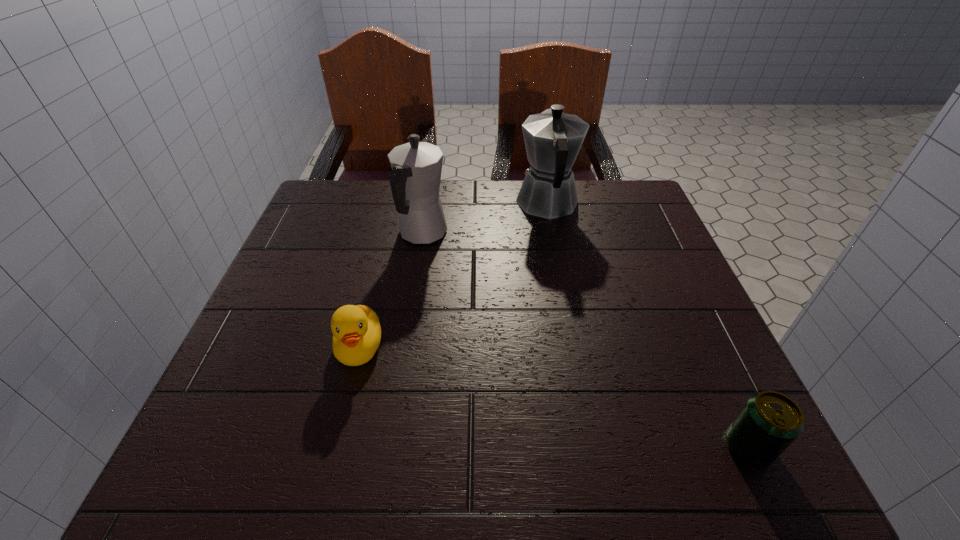
Locate an element on the screen. vacant space that satisfies the following two spatial constraints: 1. on the front side of the beer can; 2. on the right side of the left coffeepot is located at coordinates (391, 447).